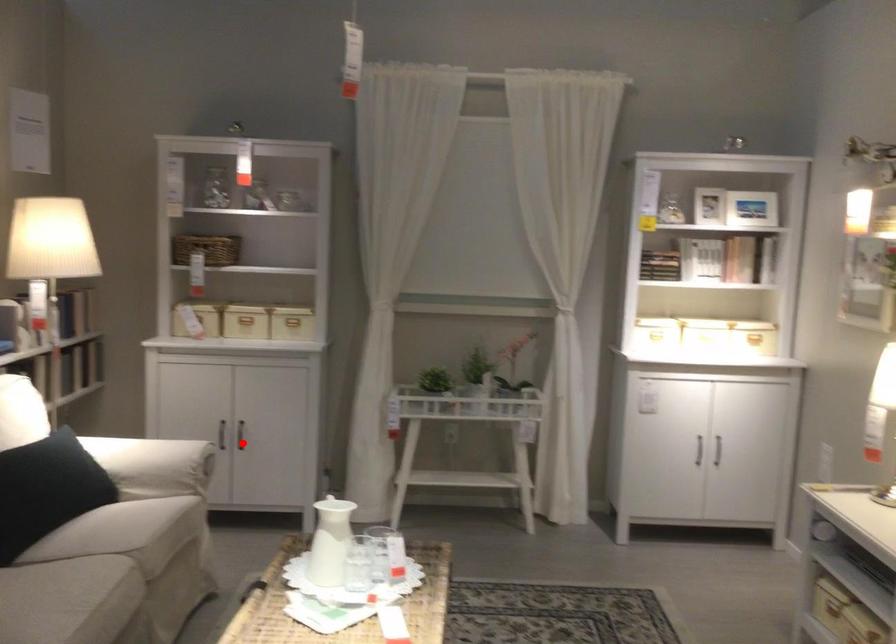
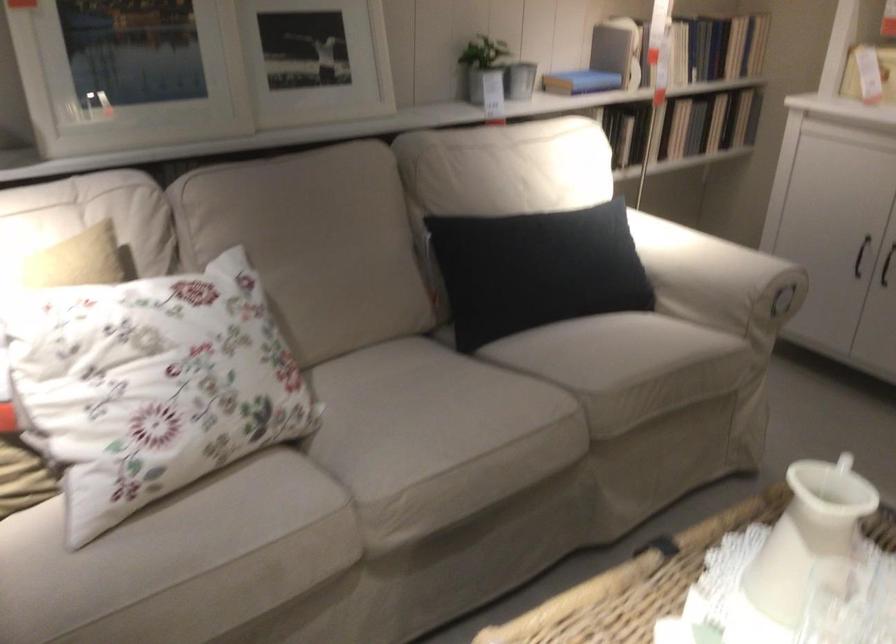
Locate, in the second image, the point that corresponds to the highlighted location in the first image.

(886, 265)